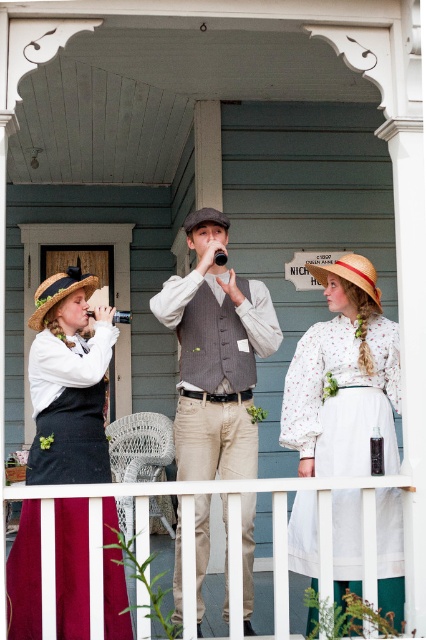
Identify the location of white floral blouse at center. (344, 378).

Find the location of `white floral blouse at center`. white floral blouse at center is located at coordinates (344, 378).

Locate an element on the screen. The image size is (426, 640). natural straw hat at left is located at coordinates point(60,292).

Who is lower down, natural straw hat at left or brown felt cowboy hat at center?

Positioned lower is natural straw hat at left.

Which is in front, point (48, 298) or point (184, 227)?

Point (48, 298)

Where is `natural straw hat at left`? natural straw hat at left is located at coordinates (60, 292).

Who is taller, white floral blouse at center or brown felt cowboy hat at center?

With more height is white floral blouse at center.

Does point (298, 433) come closer to viewer compared to point (218, 216)?

Yes.

Locate an element on the screen. The width and height of the screenshot is (426, 640). white floral blouse at center is located at coordinates (344, 378).